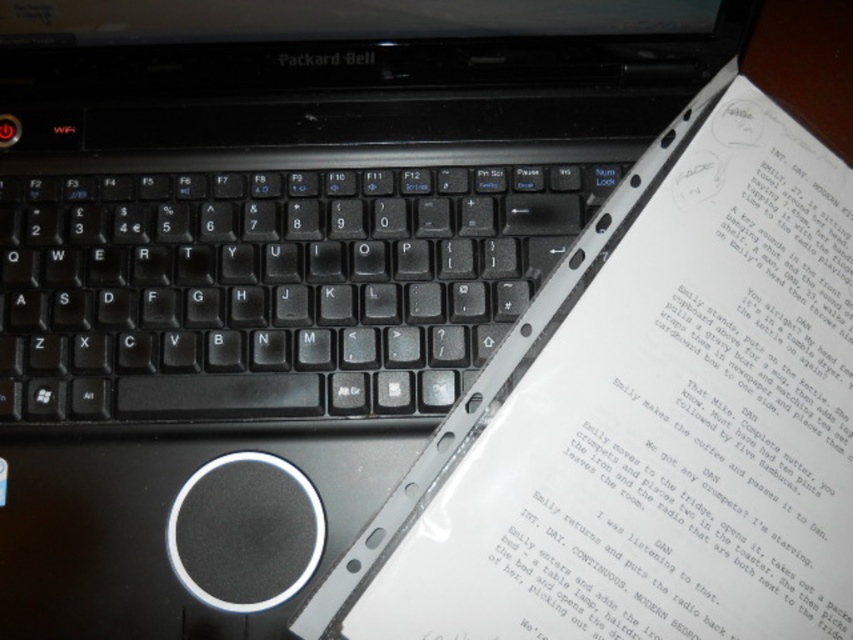
Question: Which of the following is the closest to the observer?

Choices:
 (A) (809, 637)
 (B) (206, 225)

Answer: (A)

Question: Where is white paper at upper right located in relation to black plastic keyboard at center in the image?

Choices:
 (A) left
 (B) right

Answer: (B)

Question: Among these objects, which one is farthest from the camera?

Choices:
 (A) white paper at upper right
 (B) black plastic keyboard at center

Answer: (B)

Question: Is white paper at upper right above black plastic keyboard at center?

Choices:
 (A) no
 (B) yes

Answer: (A)

Question: Is white paper at upper right wider than black plastic keyboard at center?

Choices:
 (A) no
 (B) yes

Answer: (A)